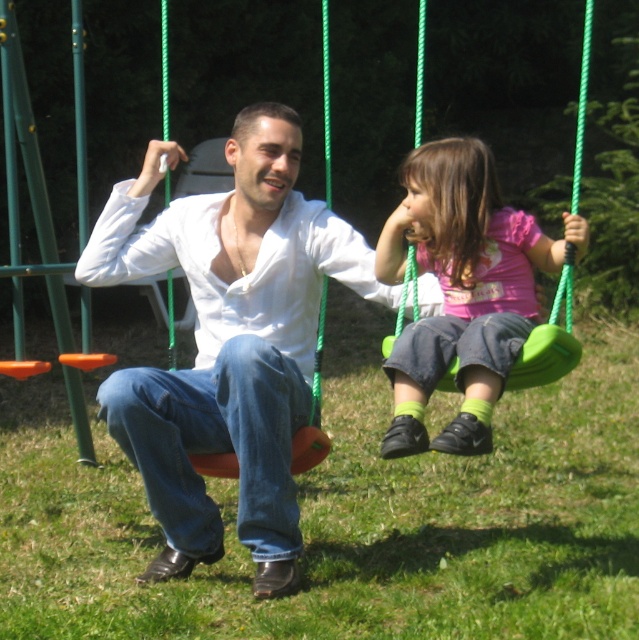
You are a photographer standing between the two swings. You want to take a photo that includes both the white matte shirt at center and the pink matte shirt at center. The camera you are using has a maximum focus range of 50 centimeters. Will you be able to capture both subjects in focus without moving?

The distance between the white matte shirt at center and the pink matte shirt at center is 45.44 centimeters, which is within the camera maximum focus range of 50 centimeters. Therefore, you can capture both subjects in focus without moving.

You are standing at the center of the image and want to locate the white matte shirt at center. According to the coordinates provided, in which direction should you look relative to the center?

The white matte shirt at center is located at coordinates point (227, 340), which means it is slightly to the right and above the center point of the image.